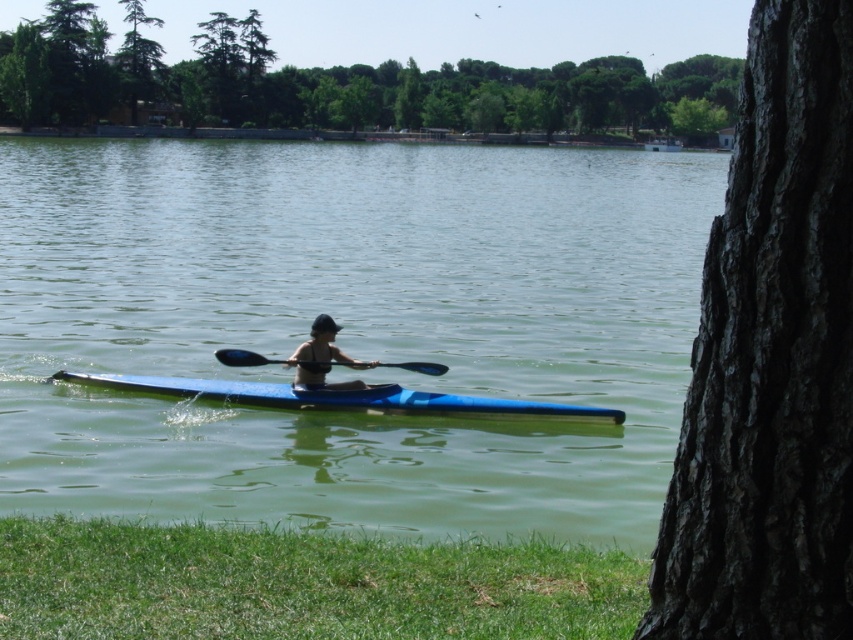
Question: Does green water at center come in front of dark bark tree trunk at right?

Choices:
 (A) yes
 (B) no

Answer: (B)

Question: Which object appears closest to the camera in this image?

Choices:
 (A) dark bark tree trunk at right
 (B) blue plastic paddle at center
 (C) blue plastic kayak at center

Answer: (A)

Question: Is green rough bark tree at center above blue plastic paddle at center?

Choices:
 (A) no
 (B) yes

Answer: (B)

Question: Which object appears closest to the camera in this image?

Choices:
 (A) green rough bark tree at center
 (B) matte black kayak at center
 (C) blue plastic kayak at center

Answer: (B)

Question: Considering the relative positions of green rough bark tree at center and matte black kayak at center in the image provided, where is green rough bark tree at center located with respect to matte black kayak at center?

Choices:
 (A) above
 (B) below

Answer: (A)

Question: Which object appears farthest from the camera in this image?

Choices:
 (A) blue plastic kayak at center
 (B) blue plastic paddle at center
 (C) green water at center
 (D) green rough bark tree at center

Answer: (D)